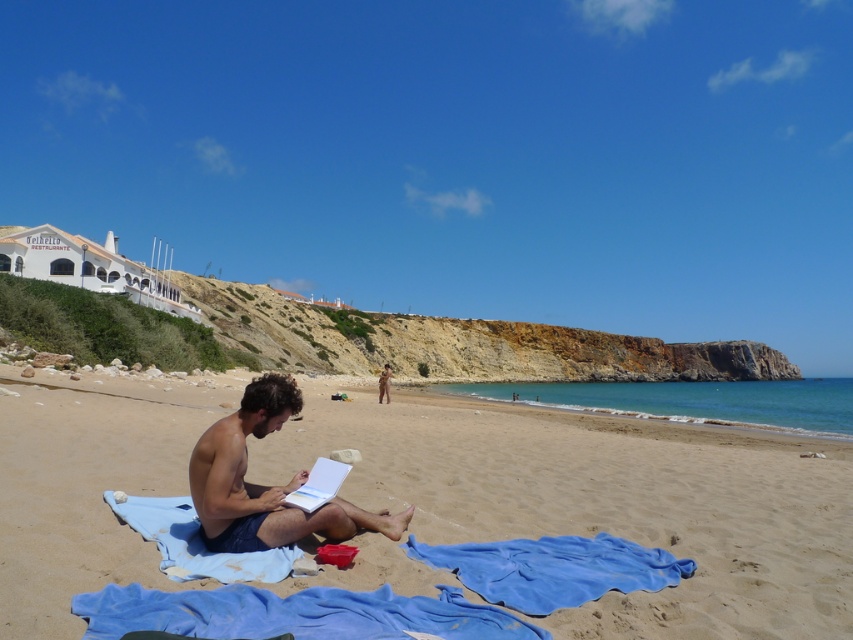
Question: Can you confirm if blue fabric at lower center is bigger than blue fabric towel at center?

Choices:
 (A) no
 (B) yes

Answer: (A)

Question: Which object is farther from the camera taking this photo?

Choices:
 (A) nude human at center
 (B) blue fabric at lower center
 (C) smooth skin man at center
 (D) blue soft towel at lower center

Answer: (A)

Question: Which object appears closest to the camera in this image?

Choices:
 (A) sandy beach at center
 (B) smooth skin man at center

Answer: (A)

Question: Is sandy beach at center thinner than smooth skin man at center?

Choices:
 (A) no
 (B) yes

Answer: (A)

Question: Which point is closer to the camera?

Choices:
 (A) tap(741, 502)
 (B) tap(289, 541)

Answer: (B)

Question: Can you confirm if smooth skin man at center is positioned above blue soft towel at lower center?

Choices:
 (A) yes
 (B) no

Answer: (A)